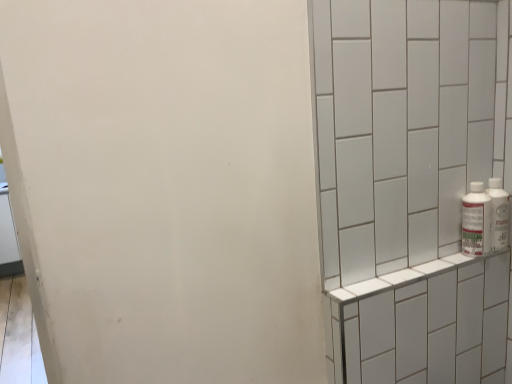
Question: From the image's perspective, would you say white plastic bottles at right, which is counted as the second bottle, starting from the left, is positioned over white tile shelf at right?

Choices:
 (A) yes
 (B) no

Answer: (A)

Question: Is white plastic bottles at right, which is counted as the second bottle, starting from the left, to the left of white tile shelf at right from the viewer's perspective?

Choices:
 (A) yes
 (B) no

Answer: (B)

Question: Is white plastic bottles at right, the 1th bottle in the right-to-left sequence, facing towards white tile shelf at right?

Choices:
 (A) no
 (B) yes

Answer: (A)

Question: Are white plastic bottles at right, which is counted as the second bottle, starting from the left, and white tile shelf at right located far from each other?

Choices:
 (A) no
 (B) yes

Answer: (A)

Question: Considering the relative sizes of white plastic bottles at right, the 1th bottle in the right-to-left sequence, and white tile shelf at right in the image provided, is white plastic bottles at right, the 1th bottle in the right-to-left sequence, shorter than white tile shelf at right?

Choices:
 (A) yes
 (B) no

Answer: (A)

Question: Does white plastic bottles at right, the 1th bottle in the right-to-left sequence, appear on the right side of white tile shelf at right?

Choices:
 (A) no
 (B) yes

Answer: (B)

Question: Is white tile shelf at right positioned beyond the bounds of white plastic bottle at right, the 2th bottle from the right?

Choices:
 (A) no
 (B) yes

Answer: (B)

Question: From the image's perspective, is white tile shelf at right above white plastic bottle at right, the 2th bottle from the right?

Choices:
 (A) no
 (B) yes

Answer: (A)

Question: Is white tile shelf at right to the left of white plastic bottle at right, the 2th bottle from the right, from the viewer's perspective?

Choices:
 (A) yes
 (B) no

Answer: (A)

Question: Is white tile shelf at right further to the viewer compared to white plastic bottle at right, the 2th bottle from the right?

Choices:
 (A) no
 (B) yes

Answer: (A)

Question: Considering the relative positions of white tile shelf at right and white plastic bottle at right, the first bottle from the left, in the image provided, is white tile shelf at right to the right of white plastic bottle at right, the first bottle from the left, from the viewer's perspective?

Choices:
 (A) no
 (B) yes

Answer: (A)

Question: Does white tile shelf at right have a smaller size compared to white plastic bottle at right, the 2th bottle from the right?

Choices:
 (A) no
 (B) yes

Answer: (A)

Question: From the image's perspective, would you say white plastic bottle at right, the first bottle from the left, is shown under white tile shelf at right?

Choices:
 (A) yes
 (B) no

Answer: (B)